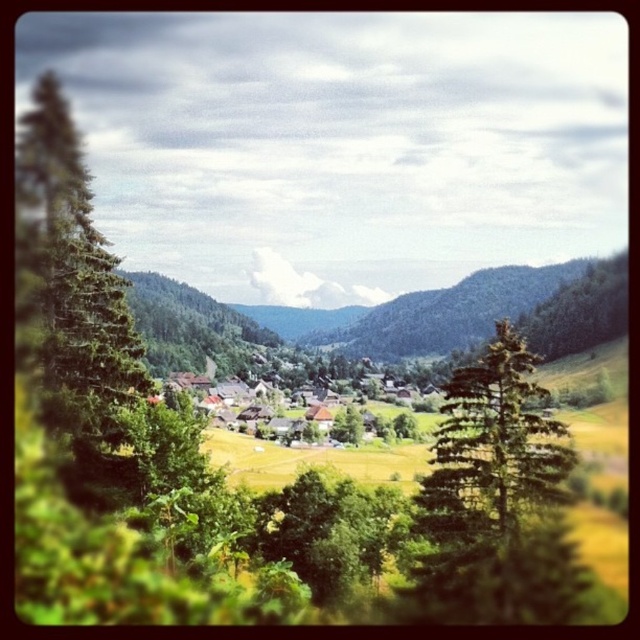
You are a drone operator tasked with capturing aerial footage of the wooden houses at center and the green leafy tree at center. Based on the scene, which object would require a wider camera frame to fully capture in your footage?

The wooden houses at center have a greater width than the green leafy tree at center, so the wooden houses at center would require a wider camera frame to fully capture in the footage.

You are standing at the top of a hill overlooking the valley. You see the wooden houses at center and the green leafy tree at center. Which one appears larger from your vantage point?

The wooden houses at center appears larger than the green leafy tree at center from your vantage point.